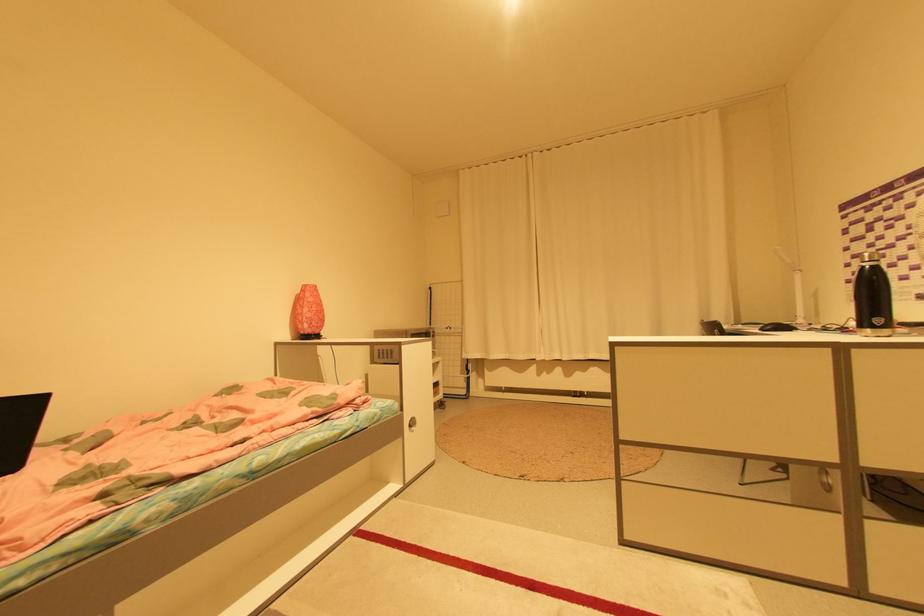
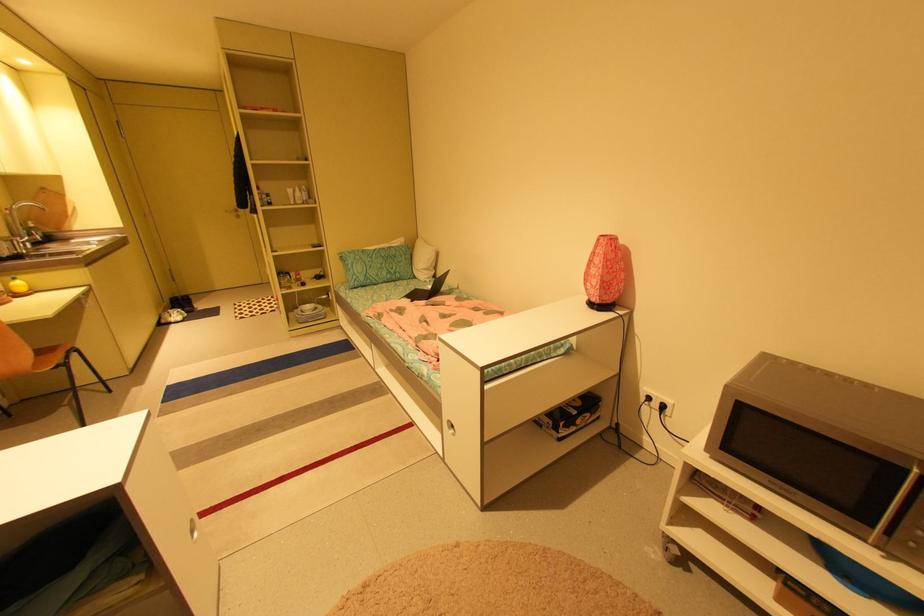
Find the pixel in the second image that matches the point at 311,285 in the first image.

(608, 236)